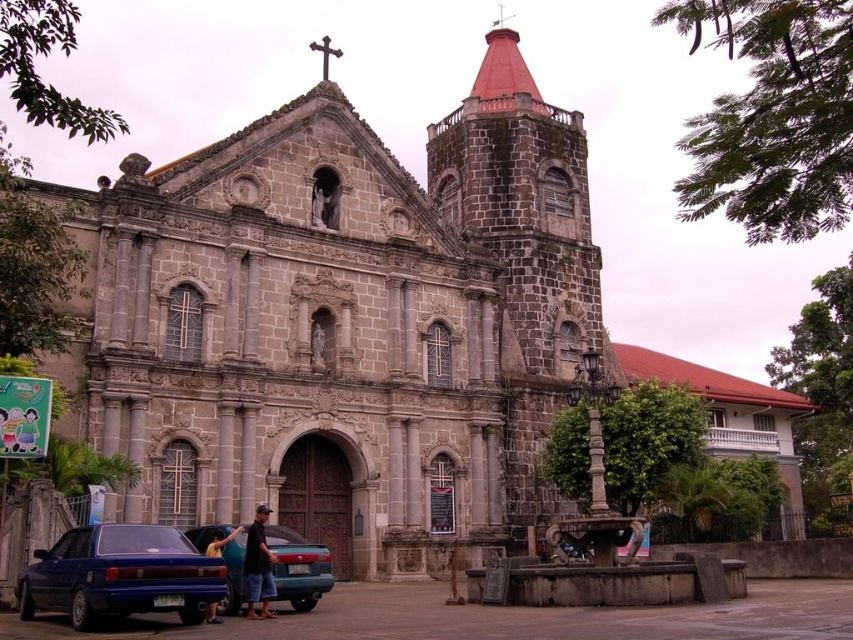
You are standing at the center of the paved area in front of the historic stone church. You want to park your car in the closest available spot. There is a shiny blue sedan at lower left. Where should you park your car?

The closest available parking spot would be near the shiny blue sedan at lower left since it is located at the lower left corner of the paved area, which is closer to the center compared to other potential spots.

You are standing in front of the historic stone church and want to take a photo. You notice two points marked on the ground at coordinates point (253, 618) and point (213, 536). Which point should you stand closer to if you want to be nearer to the camera position?

You should stand closer to point (253, 618) because it is closer to the camera than point (213, 536).

You are a photographer trying to capture a photo of the historic stone church. You notice a blue metallic car at lower left and a yellow fabric shirt at lower left in the foreground. Which object should you move to ensure the church is fully visible in your shot?

The blue metallic car at lower left is much taller than the yellow fabric shirt at lower left, so you should move the blue metallic car at lower left to ensure the church is fully visible in your shot.